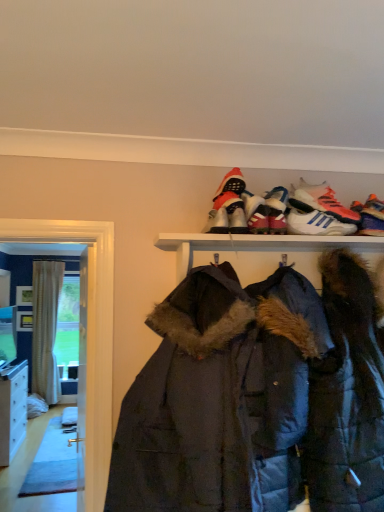
Question: Considering the relative sizes of white synthetic sneakers at upper center, which ranks as the third footwear in right-to-left order, and dark blue quilted jacket at center in the image provided, is white synthetic sneakers at upper center, which ranks as the third footwear in right-to-left order, bigger than dark blue quilted jacket at center?

Choices:
 (A) no
 (B) yes

Answer: (A)

Question: Is white synthetic sneakers at upper center, which ranks as the third footwear in right-to-left order, facing away from dark blue quilted jacket at center?

Choices:
 (A) no
 (B) yes

Answer: (A)

Question: From the image's perspective, would you say white synthetic sneakers at upper center, placed as the 4th footwear when sorted from left to right, is shown under dark blue quilted jacket at center?

Choices:
 (A) yes
 (B) no

Answer: (B)

Question: From the image's perspective, is white synthetic sneakers at upper center, placed as the 4th footwear when sorted from left to right, over dark blue quilted jacket at center?

Choices:
 (A) no
 (B) yes

Answer: (B)

Question: Is dark blue quilted jacket at center located within white synthetic sneakers at upper center, which ranks as the third footwear in right-to-left order?

Choices:
 (A) no
 (B) yes

Answer: (A)

Question: Relative to red suede boot at upper center, arranged as the fifth footwear when viewed from the right, is white leather sneakers at upper center, which is the 5th footwear in left-to-right order, in front or behind?

Choices:
 (A) behind
 (B) front

Answer: (A)

Question: Visually, is white leather sneakers at upper center, which is the 5th footwear in left-to-right order, positioned to the left or to the right of red suede boot at upper center, the second footwear in the left-to-right sequence?

Choices:
 (A) right
 (B) left

Answer: (A)

Question: Considering the positions of white leather sneakers at upper center, which is the second footwear in right-to-left order, and red suede boot at upper center, arranged as the fifth footwear when viewed from the right, in the image, is white leather sneakers at upper center, which is the second footwear in right-to-left order, wider or thinner than red suede boot at upper center, arranged as the fifth footwear when viewed from the right,?

Choices:
 (A) thin
 (B) wide

Answer: (A)

Question: From the image's perspective, relative to red suede boot at upper center, the second footwear in the left-to-right sequence, is white leather sneakers at upper center, which is the 5th footwear in left-to-right order, above or below?

Choices:
 (A) above
 (B) below

Answer: (B)

Question: From a real-world perspective, is beige striped curtain at left physically located above or below red suede boot at upper center, arranged as the fifth footwear when viewed from the right?

Choices:
 (A) above
 (B) below

Answer: (B)

Question: From their relative heights in the image, would you say beige striped curtain at left is taller or shorter than red suede boot at upper center, the second footwear in the left-to-right sequence?

Choices:
 (A) tall
 (B) short

Answer: (A)

Question: Is beige striped curtain at left spatially inside red suede boot at upper center, arranged as the fifth footwear when viewed from the right, or outside of it?

Choices:
 (A) outside
 (B) inside

Answer: (A)

Question: Considering the positions of point (56, 300) and point (236, 190), is point (56, 300) closer or farther from the camera than point (236, 190)?

Choices:
 (A) farther
 (B) closer

Answer: (A)

Question: Relative to beige striped curtain at left, is dark blue quilted jacket at center in front or behind?

Choices:
 (A) front
 (B) behind

Answer: (A)

Question: Is dark blue quilted jacket at center bigger or smaller than beige striped curtain at left?

Choices:
 (A) big
 (B) small

Answer: (A)